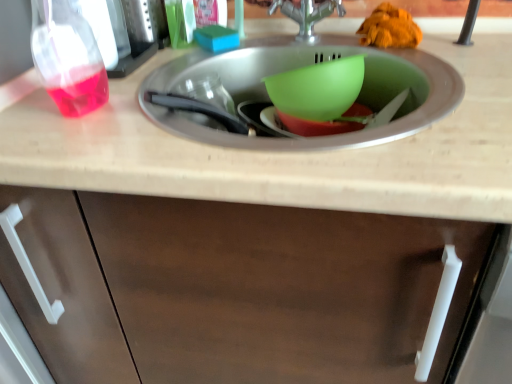
The height and width of the screenshot is (384, 512). What do you see at coordinates (67, 58) in the screenshot?
I see `transparent plastic bottle at left` at bounding box center [67, 58].

Describe the element at coordinates (132, 34) in the screenshot. The image size is (512, 384). I see `transparent plastic spray bottle at left` at that location.

The image size is (512, 384). What do you see at coordinates (317, 126) in the screenshot? I see `green plastic bowl at center, which ranks as the second basin in top-to-bottom order` at bounding box center [317, 126].

Locate an element on the screen. transparent plastic bottle at left is located at coordinates (67, 58).

Can you tell me how much transparent plastic spray bottle at left and orange fuzzy sponge at upper right, the first food viewed from the right, differ in facing direction?

There is a 0.00137-degree angle between the facing directions of transparent plastic spray bottle at left and orange fuzzy sponge at upper right, the first food viewed from the right.

Which object is positioned more to the right, transparent plastic spray bottle at left or orange fuzzy sponge at upper right, the first food viewed from the right?

Positioned to the right is orange fuzzy sponge at upper right, the first food viewed from the right.

Which is closer, (x=136, y=39) or (x=418, y=27)?

The point (x=418, y=27) is closer to the camera.

Is transparent plastic spray bottle at left touching orange fuzzy sponge at upper right, the first food viewed from the right?

No, transparent plastic spray bottle at left is not next to orange fuzzy sponge at upper right, the first food viewed from the right.

From a real-world perspective, is orange fuzzy sponge at upper right, which is the 2th food from left to right, above or below green plastic bowl at center, which is the 1th basin in top-to-bottom order?

In terms of real-world spatial position, orange fuzzy sponge at upper right, which is the 2th food from left to right, is above green plastic bowl at center, which is the 1th basin in top-to-bottom order.

From the image's perspective, is orange fuzzy sponge at upper right, which is the 2th food from left to right, on green plastic bowl at center, placed as the second basin when sorted from bottom to top?

Yes, from the image's perspective, orange fuzzy sponge at upper right, which is the 2th food from left to right, is above green plastic bowl at center, placed as the second basin when sorted from bottom to top.

Is orange fuzzy sponge at upper right, the first food viewed from the right, oriented away from green plastic bowl at center, placed as the second basin when sorted from bottom to top?

No, green plastic bowl at center, placed as the second basin when sorted from bottom to top, is not at the back of orange fuzzy sponge at upper right, the first food viewed from the right.

Which object is positioned more to the left, orange fuzzy sponge at upper right, the first food viewed from the right, or green plastic bowl at center, placed as the second basin when sorted from bottom to top?

Positioned to the left is green plastic bowl at center, placed as the second basin when sorted from bottom to top.

Does beige laminate countertop at center appear on the right side of green plastic bowl at center, placed as the second basin when sorted from bottom to top?

Incorrect, beige laminate countertop at center is not on the right side of green plastic bowl at center, placed as the second basin when sorted from bottom to top.

Considering the sizes of objects beige laminate countertop at center and green plastic bowl at center, placed as the second basin when sorted from bottom to top, in the image provided, who is smaller, beige laminate countertop at center or green plastic bowl at center, placed as the second basin when sorted from bottom to top,?

Smaller between the two is green plastic bowl at center, placed as the second basin when sorted from bottom to top.

Based on the photo, from the image's perspective, is beige laminate countertop at center located above or below green plastic bowl at center, placed as the second basin when sorted from bottom to top?

From the image's perspective, beige laminate countertop at center appears below green plastic bowl at center, placed as the second basin when sorted from bottom to top.

Is beige laminate countertop at center not close to green plastic bowl at center, which is the 1th basin in top-to-bottom order?

That's not correct — beige laminate countertop at center is a little close to green plastic bowl at center, which is the 1th basin in top-to-bottom order.

Considering the relative sizes of green plastic bowl at center, which is the 1th basin in top-to-bottom order, and orange fuzzy sponge at upper right, which is the 2th food from left to right, in the image provided, is green plastic bowl at center, which is the 1th basin in top-to-bottom order, smaller than orange fuzzy sponge at upper right, which is the 2th food from left to right,?

No, green plastic bowl at center, which is the 1th basin in top-to-bottom order, is not smaller than orange fuzzy sponge at upper right, which is the 2th food from left to right.

Which is correct: green plastic bowl at center, placed as the second basin when sorted from bottom to top, is inside orange fuzzy sponge at upper right, which is the 2th food from left to right, or outside of it?

green plastic bowl at center, placed as the second basin when sorted from bottom to top, is outside orange fuzzy sponge at upper right, which is the 2th food from left to right.

From the image's perspective, is green plastic bowl at center, which is the 1th basin in top-to-bottom order, located beneath orange fuzzy sponge at upper right, which is the 2th food from left to right?

Yes, from the image's perspective, green plastic bowl at center, which is the 1th basin in top-to-bottom order, is beneath orange fuzzy sponge at upper right, which is the 2th food from left to right.

Is green plastic bowl at center, placed as the second basin when sorted from bottom to top, taller than orange fuzzy sponge at upper right, which is the 2th food from left to right?

Correct, green plastic bowl at center, placed as the second basin when sorted from bottom to top, is much taller as orange fuzzy sponge at upper right, which is the 2th food from left to right.

Based on the photo, is green plastic bowl at center, which is counted as the 1th basin, starting from the bottom, inside or outside of transparent plastic spray bottle at left?

green plastic bowl at center, which is counted as the 1th basin, starting from the bottom, exists outside the volume of transparent plastic spray bottle at left.

Is green plastic bowl at center, which is counted as the 1th basin, starting from the bottom, taller or shorter than transparent plastic spray bottle at left?

green plastic bowl at center, which is counted as the 1th basin, starting from the bottom, is shorter than transparent plastic spray bottle at left.

Does green plastic bowl at center, which ranks as the second basin in top-to-bottom order, appear on the right side of transparent plastic spray bottle at left?

Correct, you'll find green plastic bowl at center, which ranks as the second basin in top-to-bottom order, to the right of transparent plastic spray bottle at left.

Could you measure the distance between green plastic bowl at center, which ranks as the second basin in top-to-bottom order, and green plastic bowl at center, which is the 1th basin in top-to-bottom order?

green plastic bowl at center, which ranks as the second basin in top-to-bottom order, is 4.64 centimeters away from green plastic bowl at center, which is the 1th basin in top-to-bottom order.

Which object is further away from the camera taking this photo, green plastic bowl at center, which ranks as the second basin in top-to-bottom order, or green plastic bowl at center, which is the 1th basin in top-to-bottom order?

green plastic bowl at center, which ranks as the second basin in top-to-bottom order, is more distant.

Could green plastic bowl at center, which is the 1th basin in top-to-bottom order, be considered to be inside green plastic bowl at center, which ranks as the second basin in top-to-bottom order?

No, green plastic bowl at center, which is the 1th basin in top-to-bottom order, is located outside of green plastic bowl at center, which ranks as the second basin in top-to-bottom order.

Is green plastic bowl at center, which is counted as the 1th basin, starting from the bottom, looking in the opposite direction of green plastic bowl at center, which is the 1th basin in top-to-bottom order?

No, green plastic bowl at center, which is counted as the 1th basin, starting from the bottom, is not facing away from green plastic bowl at center, which is the 1th basin in top-to-bottom order.

Is transparent plastic bottle at left facing towards blue sponge at upper center, which appears as the second food when viewed from the right?

No.

Considering the positions of point (60, 23) and point (206, 39), is point (60, 23) closer or farther from the camera than point (206, 39)?

Point (60, 23) appears to be closer to the viewer than point (206, 39).

Which is behind, transparent plastic bottle at left or blue sponge at upper center, the 1th food positioned from the left?

Positioned behind is blue sponge at upper center, the 1th food positioned from the left.

The image size is (512, 384). I want to click on appliance in front of the orange fuzzy sponge at upper right, which is the 2th food from left to right, so (x=132, y=34).

At what (x,y) coordinates should I click in order to perform the action: click on food that is the 2nd object above the green plastic bowl at center, placed as the second basin when sorted from bottom to top (from a real-world perspective). Please return your answer as a coordinate pair (x, y). The image size is (512, 384). Looking at the image, I should click on (390, 28).

Looking at the image, which one is located closer to beige laminate countertop at center, blue sponge at upper center, which appears as the second food when viewed from the right, or green plastic bowl at center, which is counted as the 1th basin, starting from the bottom?

green plastic bowl at center, which is counted as the 1th basin, starting from the bottom, lies closer to beige laminate countertop at center than the other object.

Based on their spatial positions, is green plastic bowl at center, which is the 1th basin in top-to-bottom order, or beige laminate countertop at center closer to orange fuzzy sponge at upper right, the first food viewed from the right?

Among the two, green plastic bowl at center, which is the 1th basin in top-to-bottom order, is located nearer to orange fuzzy sponge at upper right, the first food viewed from the right.

When comparing their distances from blue sponge at upper center, which appears as the second food when viewed from the right, does silver metallic tap at center or orange fuzzy sponge at upper right, which is the 2th food from left to right, seem further?

orange fuzzy sponge at upper right, which is the 2th food from left to right.

Based on the photo, based on their spatial positions, is green plastic bowl at center, which ranks as the second basin in top-to-bottom order, or orange fuzzy sponge at upper right, the first food viewed from the right, further from beige laminate countertop at center?

orange fuzzy sponge at upper right, the first food viewed from the right, is further to beige laminate countertop at center.

Based on the photo, when comparing their distances from silver metallic tap at center, does green plastic bowl at center, placed as the second basin when sorted from bottom to top, or transparent plastic bottle at left seem closer?

The object closer to silver metallic tap at center is green plastic bowl at center, placed as the second basin when sorted from bottom to top.

Considering their positions, is green plastic bowl at center, placed as the second basin when sorted from bottom to top, positioned further to blue sponge at upper center, which appears as the second food when viewed from the right, than silver metallic tap at center?

The object further to blue sponge at upper center, which appears as the second food when viewed from the right, is green plastic bowl at center, placed as the second basin when sorted from bottom to top.

Based on their spatial positions, is orange fuzzy sponge at upper right, the first food viewed from the right, or blue sponge at upper center, which appears as the second food when viewed from the right, closer to transparent plastic spray bottle at left?

blue sponge at upper center, which appears as the second food when viewed from the right.

Considering their positions, is green plastic bowl at center, which is counted as the 1th basin, starting from the bottom, positioned further to orange fuzzy sponge at upper right, which is the 2th food from left to right, than transparent plastic bottle at left?

transparent plastic bottle at left lies further to orange fuzzy sponge at upper right, which is the 2th food from left to right, than the other object.

Find the location of a particular element. Image resolution: width=512 pixels, height=384 pixels. food between transparent plastic spray bottle at left and orange fuzzy sponge at upper right, which is the 2th food from left to right, in the horizontal direction is located at coordinates (216, 38).

Where is `basin that lies between silver metallic tap at center and green plastic bowl at center, which is counted as the 1th basin, starting from the bottom, from top to bottom`? The width and height of the screenshot is (512, 384). basin that lies between silver metallic tap at center and green plastic bowl at center, which is counted as the 1th basin, starting from the bottom, from top to bottom is located at coordinates (318, 89).

Find the location of a particular element. The height and width of the screenshot is (384, 512). countertop between transparent plastic bottle at left and green plastic bowl at center, placed as the second basin when sorted from bottom to top, from left to right is located at coordinates (285, 153).

At what (x,y) coordinates should I click in order to perform the action: click on bottle between transparent plastic spray bottle at left and silver metallic tap at center in the horizontal direction. Please return your answer as a coordinate pair (x, y). This screenshot has width=512, height=384. Looking at the image, I should click on (67, 58).